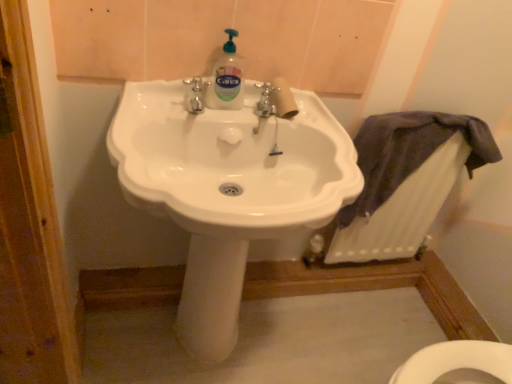
Find the location of a particular element. This screenshot has height=384, width=512. vacant point to the left of translucent plastic bottle at center is located at coordinates (159, 104).